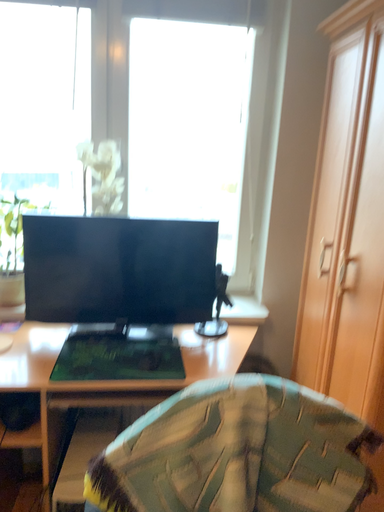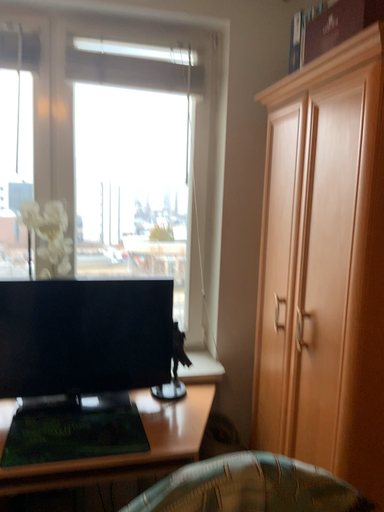
Question: How did the camera likely rotate when shooting the video?

Choices:
 (A) rotated right
 (B) rotated left

Answer: (A)